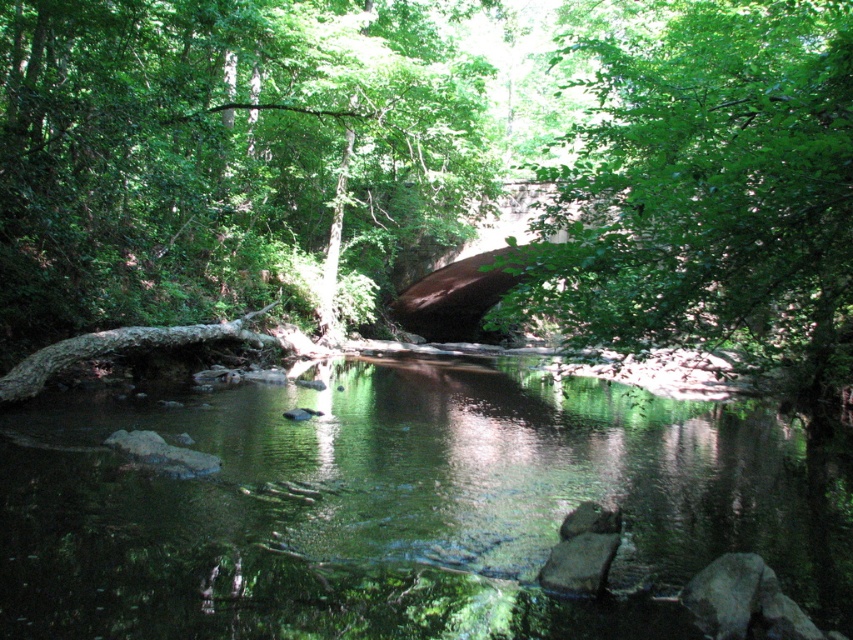
You are planning to cross the stream using a small boat that is 2 meters long. The boat requires at least 6 meters of open water between the brown rough log at left and the green reflective water at center to safely navigate. Can you safely cross the stream using this boat?

The distance between the brown rough log at left and the green reflective water at center is 5.77 meters, which is less than the required 6 meters. Therefore, you cannot safely cross the stream using the boat.

You are a hiker who wants to cross the stream using the stone bridge. However, you notice the green reflective water at center and the brown rough log at left. Which object is bigger in size?

The green reflective water at center has a larger size compared to the brown rough log at left, so the green reflective water at center is bigger in size.

You are a hiker who wants to take a photo of the green leafy tree at center and the brown rough log at left. Which object should you focus on first if you want to capture both in a single frame without moving the camera?

The green leafy tree at center is bigger than the brown rough log at left, so you should focus on the green leafy tree at center first to ensure it fills the frame appropriately before adjusting for the smaller log.